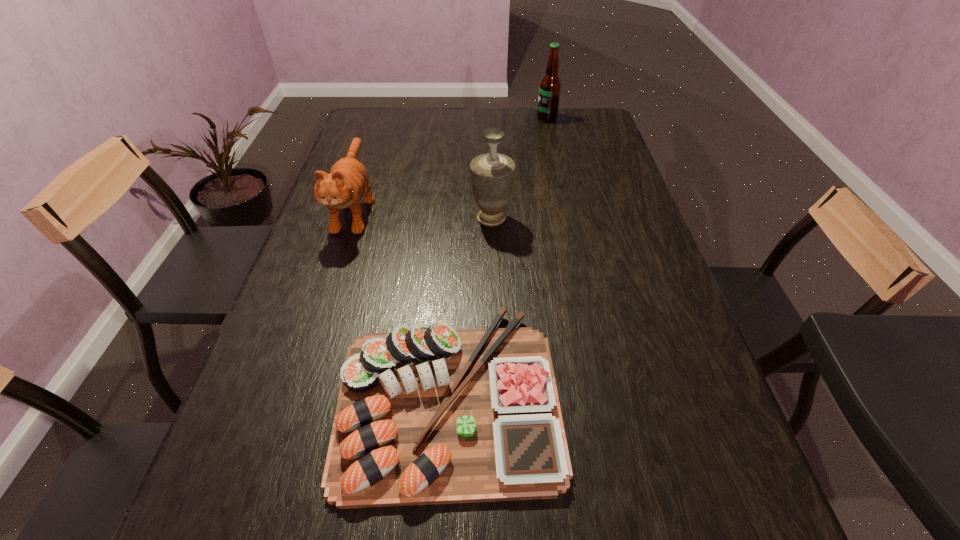
The height and width of the screenshot is (540, 960). In order to click on free space between the platter and the urn in this screenshot , I will do `click(469, 307)`.

Where is `empty space that is in between the second shortest object and the nearest object`? The width and height of the screenshot is (960, 540). empty space that is in between the second shortest object and the nearest object is located at coordinates (400, 302).

Image resolution: width=960 pixels, height=540 pixels. In order to click on free space between the second shortest object and the shortest object in this screenshot , I will do `click(400, 302)`.

In order to click on blank region between the nearest object and the beer bottle in this screenshot , I will do `click(496, 257)`.

Identify the location of vacant area that lies between the farthest object and the shortest object. The image size is (960, 540). (496, 257).

At what (x,y) coordinates should I click in order to perform the action: click on vacant point located between the cat and the rightmost object. Please return your answer as a coordinate pair (x, y). This screenshot has height=540, width=960. Looking at the image, I should click on (450, 163).

Find the location of a particular element. The height and width of the screenshot is (540, 960). free spot between the urn and the cat is located at coordinates (423, 213).

This screenshot has width=960, height=540. I want to click on free spot between the farthest object and the urn, so click(519, 168).

Where is `free spot between the third tallest object and the beer bottle`? This screenshot has height=540, width=960. free spot between the third tallest object and the beer bottle is located at coordinates (450, 163).

In order to click on free space between the leftmost object and the shortest object in this screenshot , I will do `click(400, 302)`.